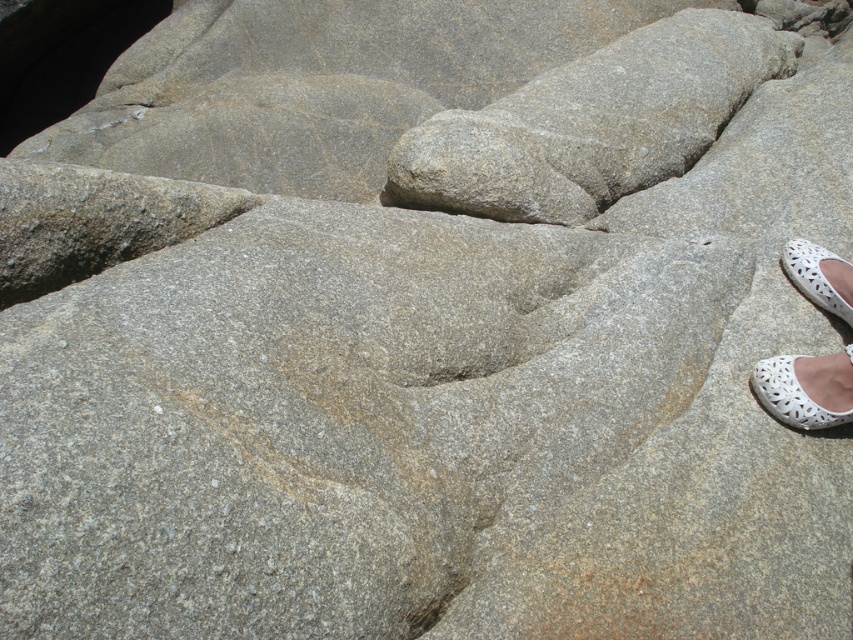
You are a hiker trying to avoid stepping on the rocks. You notice two shoes near the rocky surface. Which shoe is closer to the ground? The white lace shoe at lower right or the white mesh shoe at lower right?

The white lace shoe at lower right is closer to the ground because it is positioned below the white mesh shoe at lower right.

In the scene shown: You are a hiker who wants to place a small marker at point [792,394] to mark the location of the white lace sandal at lower right. Is this the correct coordinate for the sandal?

Yes, the white lace sandal at lower right is located at point [792,394], so placing the marker there would be correct.

You are standing on the rocky surface and want to place a small rock between the two points labeled point (842, 259) and point (804, 248). Which point should you place the rock closer to in order for it to be closer to you?

You should place the rock closer to point (842, 259) because it is closer to you than point (804, 248).